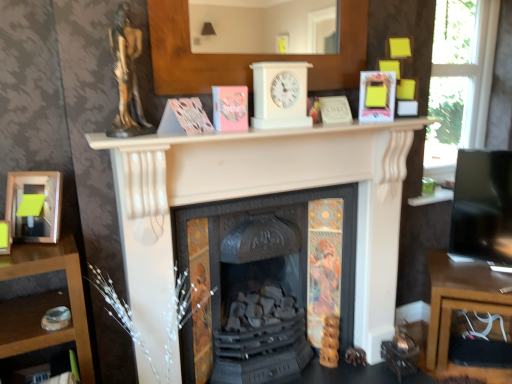
Question: Considering the positions of wooden desk at lower right and hardcover book at upper right, positioned as the 1th paperback book in right-to-left order, in the image, is wooden desk at lower right wider or thinner than hardcover book at upper right, positioned as the 1th paperback book in right-to-left order,?

Choices:
 (A) wide
 (B) thin

Answer: (A)

Question: Does point (462, 307) appear closer or farther from the camera than point (384, 79)?

Choices:
 (A) closer
 (B) farther

Answer: (B)

Question: Considering the real-world distances, which object is closest to the gold metallic statue at upper left?

Choices:
 (A) wooden desk at lower right
 (B) pink matte paper at center, positioned as the 1th paperback book in left-to-right order
 (C) white plastic clock at center
 (D) black cast iron fireplace at center, which is counted as the 1th fireplace, starting from the back
 (E) matte white book at center, marked as the second paperback book in a right-to-left arrangement

Answer: (B)

Question: Which is nearer to the wooden desk at lower right?

Choices:
 (A) black cast iron fireplace at center, which is counted as the 1th fireplace, starting from the back
 (B) gold metallic statue at upper left
 (C) white matte fireplace at center, which is counted as the 2th fireplace, starting from the back
 (D) pink matte paper at center, positioned as the 1th paperback book in left-to-right order
 (E) matte white book at center, positioned as the third paperback book in left-to-right order

Answer: (C)